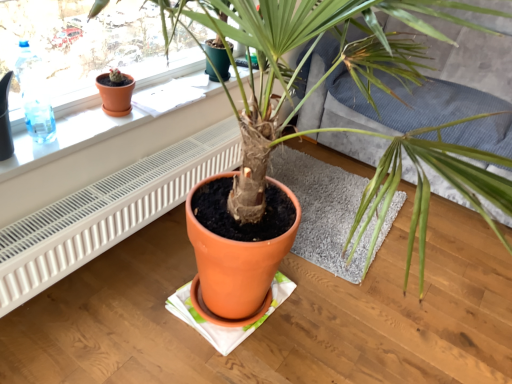
Image resolution: width=512 pixels, height=384 pixels. In order to click on free point in front of matte orange flowerpot at upper left in this screenshot , I will do `click(92, 122)`.